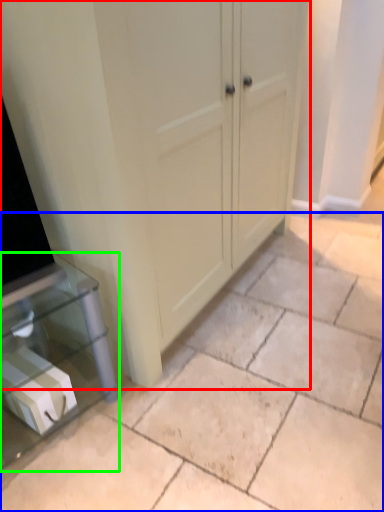
Question: Estimate the real-world distances between objects in this image. Which object is farther from cupboard (highlighted by a red box), concrete (highlighted by a blue box) or furniture (highlighted by a green box)?

Choices:
 (A) concrete
 (B) furniture

Answer: (A)